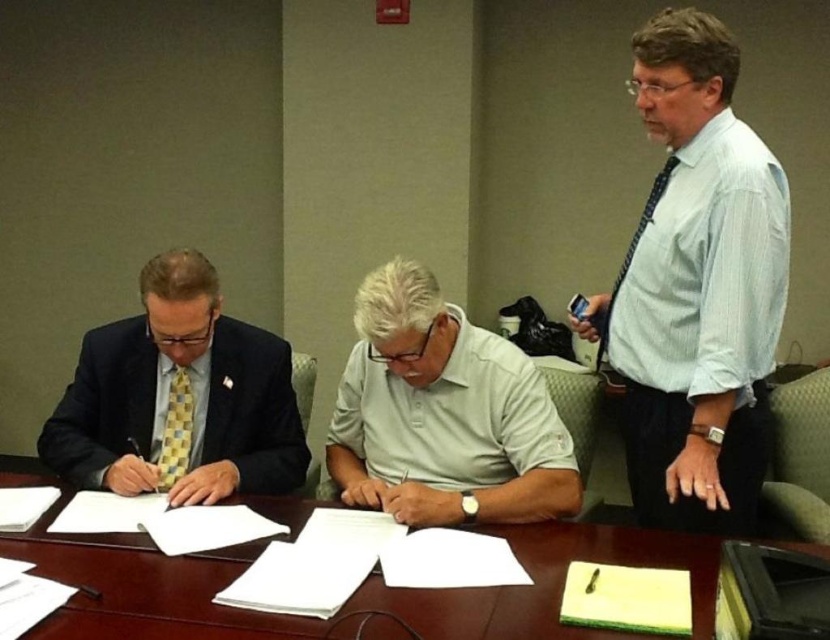
Question: Observing the image, what is the correct spatial positioning of white striped shirt at right in reference to brown wooden table at center?

Choices:
 (A) above
 (B) below

Answer: (A)

Question: Is white striped shirt at right below blue dotted tie at right?

Choices:
 (A) no
 (B) yes

Answer: (B)

Question: Based on their relative distances, which object is farther from the gray cotton polo shirt at center?

Choices:
 (A) white striped shirt at right
 (B) brown wooden table at center
 (C) checkered fabric tie at left

Answer: (C)

Question: Does gray cotton polo shirt at center lie in front of brown wooden table at center?

Choices:
 (A) no
 (B) yes

Answer: (A)

Question: Which point is closer to the camera?

Choices:
 (A) white striped shirt at right
 (B) matte yellow tie at left
 (C) gray cotton polo shirt at center

Answer: (A)

Question: Which is nearer to the matte yellow tie at left?

Choices:
 (A) white striped shirt at right
 (B) blue dotted tie at right

Answer: (A)